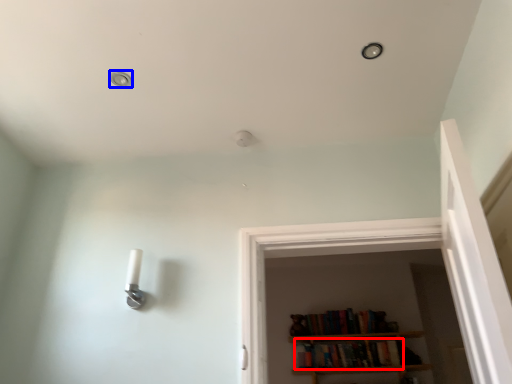
Question: Which of the following is the closest to the observer, book (highlighted by a red box) or dot (highlighted by a blue box)?

Choices:
 (A) book
 (B) dot

Answer: (B)